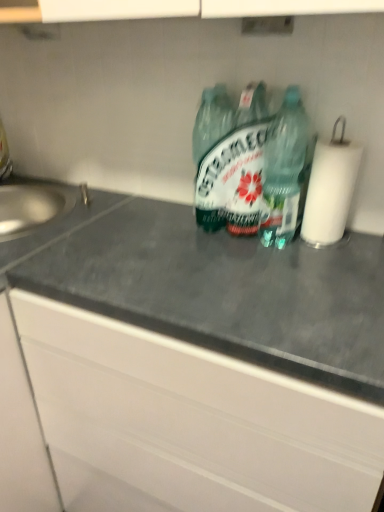
Question: Is green glass bottle at center, which is the second bottle in right-to-left order, aimed at satin silver sink at left?

Choices:
 (A) no
 (B) yes

Answer: (A)

Question: From the image's perspective, would you say green glass bottle at center, positioned as the 1th bottle in left-to-right order, is shown under satin silver sink at left?

Choices:
 (A) no
 (B) yes

Answer: (A)

Question: Can you confirm if green glass bottle at center, positioned as the 1th bottle in left-to-right order, is wider than satin silver sink at left?

Choices:
 (A) no
 (B) yes

Answer: (A)

Question: Is green glass bottle at center, positioned as the 1th bottle in left-to-right order, closer to the viewer compared to satin silver sink at left?

Choices:
 (A) yes
 (B) no

Answer: (A)

Question: Does green glass bottle at center, which is the second bottle in right-to-left order, lie behind satin silver sink at left?

Choices:
 (A) no
 (B) yes

Answer: (A)

Question: Is point (72, 205) closer or farther from the camera than point (354, 153)?

Choices:
 (A) closer
 (B) farther

Answer: (B)

Question: From their relative heights in the image, would you say satin silver sink at left is taller or shorter than white paper at right?

Choices:
 (A) short
 (B) tall

Answer: (A)

Question: In terms of width, does satin silver sink at left look wider or thinner when compared to white paper at right?

Choices:
 (A) thin
 (B) wide

Answer: (B)

Question: From the image's perspective, is satin silver sink at left positioned above or below white paper at right?

Choices:
 (A) above
 (B) below

Answer: (B)

Question: Considering the relative positions of gray matte countertop at center and satin silver sink at left in the image provided, is gray matte countertop at center to the left or to the right of satin silver sink at left?

Choices:
 (A) left
 (B) right

Answer: (B)

Question: In the image, is gray matte countertop at center positioned in front of or behind satin silver sink at left?

Choices:
 (A) behind
 (B) front

Answer: (B)

Question: Looking at the image, does gray matte countertop at center seem bigger or smaller compared to satin silver sink at left?

Choices:
 (A) small
 (B) big

Answer: (B)

Question: From a real-world perspective, is gray matte countertop at center positioned above or below satin silver sink at left?

Choices:
 (A) below
 (B) above

Answer: (A)

Question: Does point (364, 317) appear closer or farther from the camera than point (312, 182)?

Choices:
 (A) closer
 (B) farther

Answer: (A)

Question: Considering the relative positions of gray matte countertop at center and white paper at right in the image provided, is gray matte countertop at center to the left or to the right of white paper at right?

Choices:
 (A) right
 (B) left

Answer: (B)